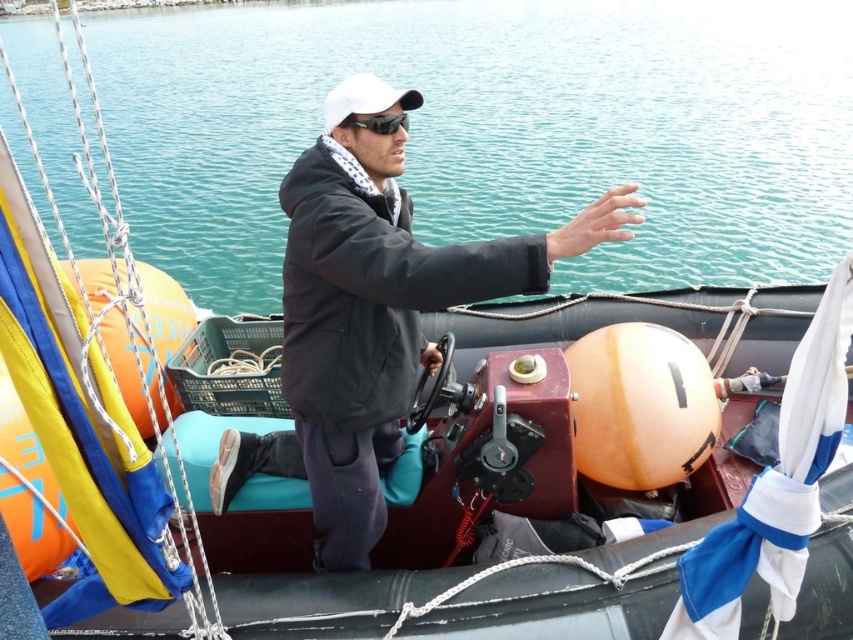
Question: Which point is closer to the camera?

Choices:
 (A) white matte baseball cap at center
 (B) black matte sunglasses at upper center

Answer: (B)

Question: Can you confirm if turquoise water at center is bigger than black matte jacket at center?

Choices:
 (A) no
 (B) yes

Answer: (B)

Question: Does turquoise water at center come in front of white matte baseball cap at center?

Choices:
 (A) yes
 (B) no

Answer: (A)

Question: Which object appears farthest from the camera in this image?

Choices:
 (A) white matte baseball cap at center
 (B) turquoise water at center
 (C) black matte sunglasses at upper center
 (D) black matte jacket at center

Answer: (A)

Question: Is black matte jacket at center positioned behind black matte sunglasses at upper center?

Choices:
 (A) yes
 (B) no

Answer: (B)

Question: Which of the following is the closest to the observer?

Choices:
 (A) (370, 124)
 (B) (331, 99)
 (C) (305, 260)
 (D) (645, 80)

Answer: (C)